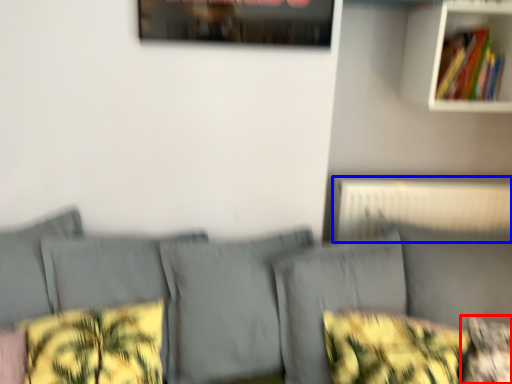
Question: Which object appears closest to the camera in this image, pillow (highlighted by a red box) or radiator (highlighted by a blue box)?

Choices:
 (A) pillow
 (B) radiator

Answer: (A)